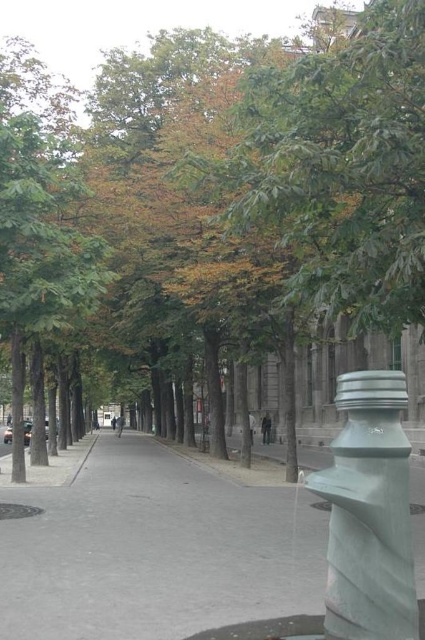
Does point (36, 428) lie behind point (342, 630)?

Yes, it is.

Is green leafy tree at left thinner than satin gray hydrant at center right?

Incorrect, green leafy tree at left's width is not less than satin gray hydrant at center right's.

Identify the location of green leafy tree at left. (39, 218).

Does gray concrete pavement at center have a lesser width compared to green leafy tree at left?

Incorrect, gray concrete pavement at center's width is not less than green leafy tree at left's.

Locate an element on the screen. The height and width of the screenshot is (640, 425). gray concrete pavement at center is located at coordinates (155, 548).

Which is behind, point (56, 564) or point (2, 216)?

Point (2, 216)

In order to click on gray concrete pavement at center in this screenshot , I will do `click(155, 548)`.

Can you confirm if gray concrete pavement at center is wider than satin gray hydrant at center right?

Yes.

Does point (27, 502) come farther from viewer compared to point (331, 451)?

Yes.

Which is in front, point (223, 554) or point (337, 404)?

Point (337, 404)

Where is `gray concrete pavement at center`? gray concrete pavement at center is located at coordinates (155, 548).